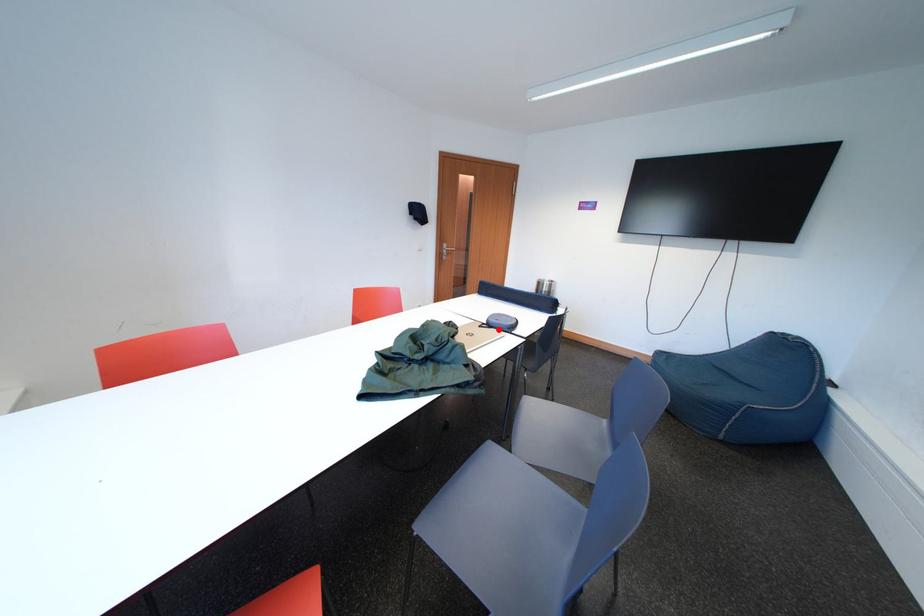
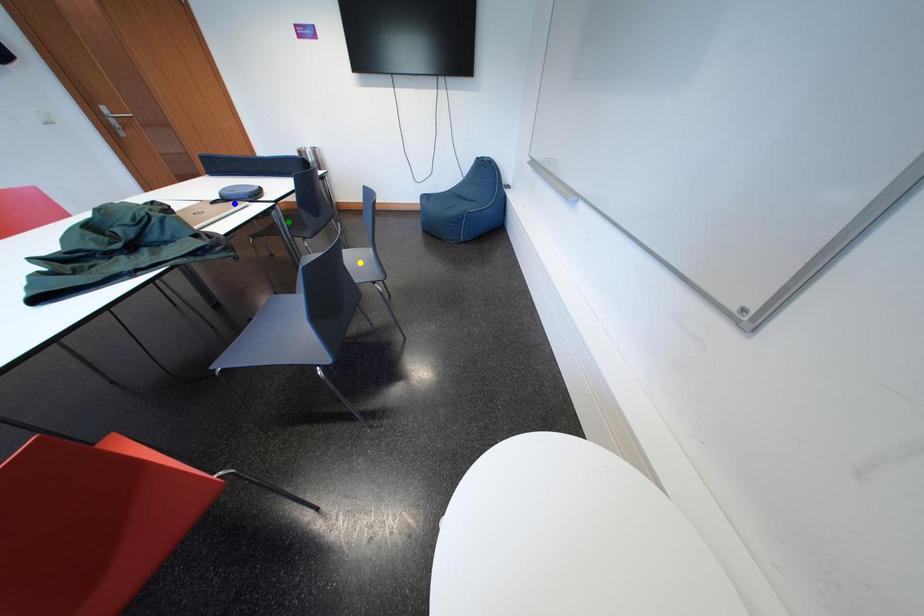
Question: I am providing you with two images of the same scene from different viewpoints. A red point is marked on the first image. You are given multiple points on the second image. Which spot in image 2 lines up with the point in image 1?

Choices:
 (A) green point
 (B) blue point
 (C) yellow point

Answer: (B)